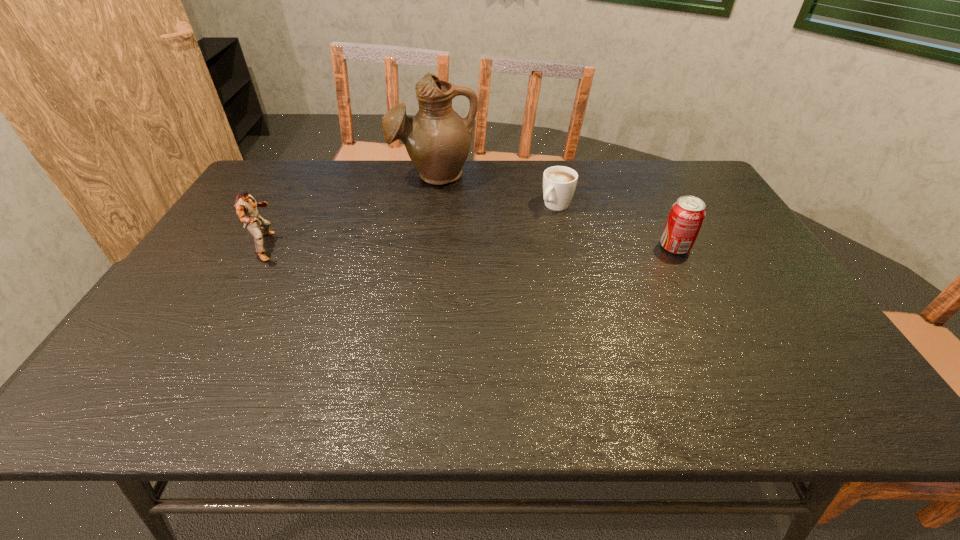
Find the location of a particular element. This screenshot has width=960, height=540. puncher is located at coordinates (246, 207).

Identify the location of the leftmost object. The width and height of the screenshot is (960, 540). (246, 207).

You are a GUI agent. You are given a task and a screenshot of the screen. Output one action in this format:
    pyautogui.click(x=<x>, y=<y>)
    Task: Click on the third tallest object
    
    Given the screenshot: What is the action you would take?
    pyautogui.click(x=687, y=214)

At what (x,y) coordinates should I click in order to perform the action: click on the rightmost object. Please return your answer as a coordinate pair (x, y). Image resolution: width=960 pixels, height=540 pixels. Looking at the image, I should click on (687, 214).

The width and height of the screenshot is (960, 540). I want to click on the second farthest object, so click(559, 182).

Where is `the shortest object`? This screenshot has width=960, height=540. the shortest object is located at coordinates (559, 182).

At what (x,y) coordinates should I click in order to perform the action: click on pitcher. Please return your answer as a coordinate pair (x, y). The width and height of the screenshot is (960, 540). Looking at the image, I should click on (438, 141).

The width and height of the screenshot is (960, 540). What are the coordinates of `the second object from left to right` in the screenshot? It's located at (438, 141).

At what (x,y) coordinates should I click in order to perform the action: click on blank space located 0.330m on the front-facing side of the leftmost object. Please return your answer as a coordinate pair (x, y). Looking at the image, I should click on (398, 247).

The height and width of the screenshot is (540, 960). I want to click on vacant region located 0.310m on the left of the third tallest object, so click(x=548, y=247).